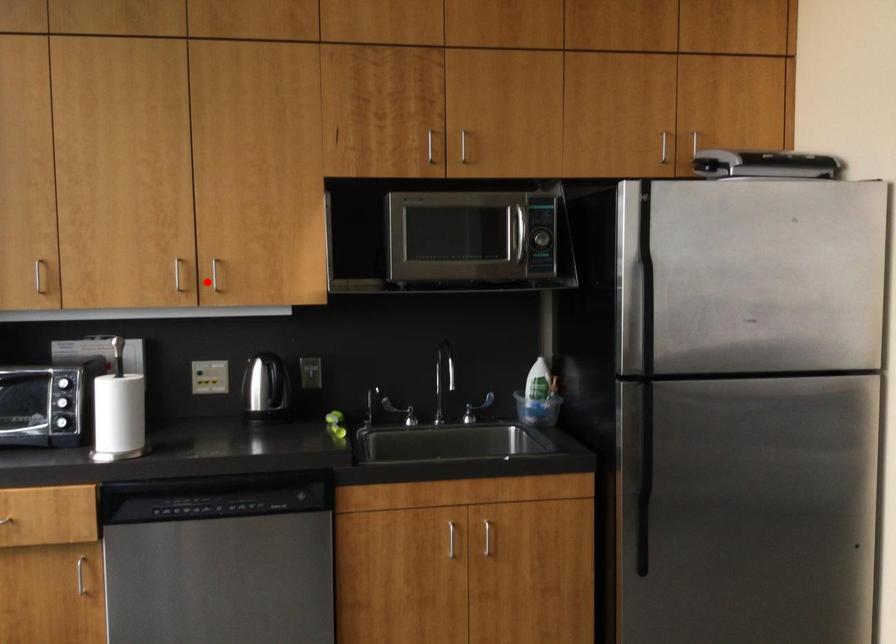
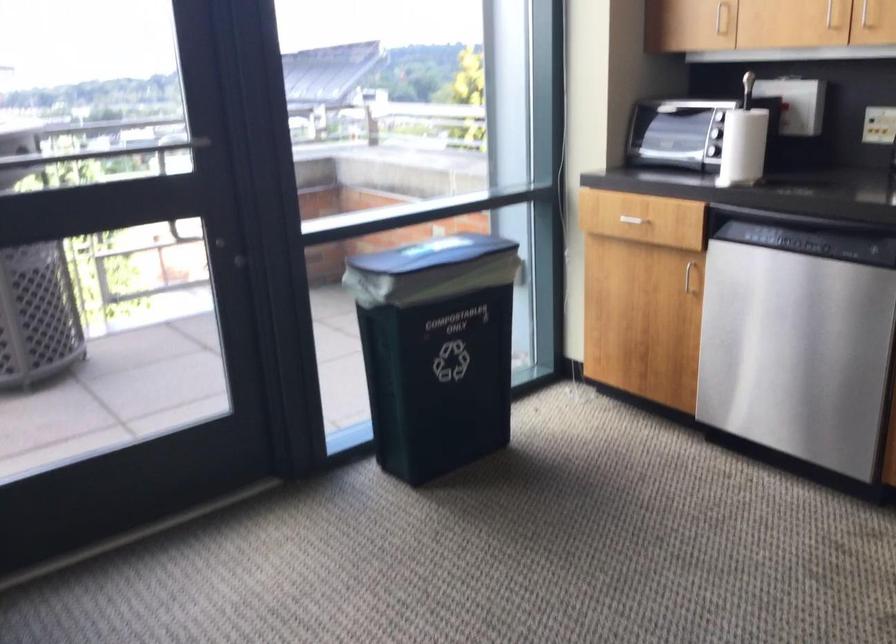
In the second image, find the point that corresponds to the highlighted location in the first image.

(865, 15)